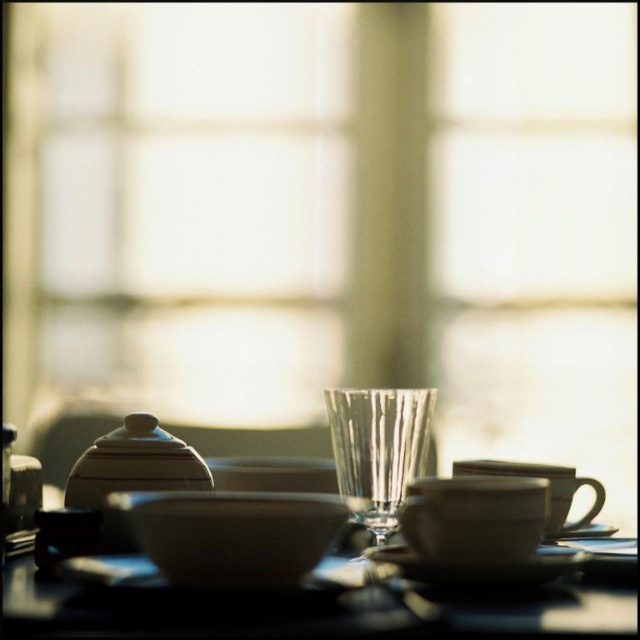
Question: Which point is closer to the camera?

Choices:
 (A) (541, 563)
 (B) (364, 522)
 (C) (499, 593)
 (D) (92, 452)

Answer: (A)

Question: Which point is closer to the camera?

Choices:
 (A) white matte saucer at lower right
 (B) black glossy saucer at center

Answer: (B)

Question: Does white glossy bowl at center come behind white matte saucer at lower right?

Choices:
 (A) no
 (B) yes

Answer: (A)

Question: Is white glossy bowl at center bigger than white matte saucer at lower right?

Choices:
 (A) yes
 (B) no

Answer: (A)

Question: Is white glossy bowl at center bigger than black glossy saucer at center?

Choices:
 (A) yes
 (B) no

Answer: (A)

Question: Among these objects, which one is nearest to the camera?

Choices:
 (A) white matte saucer at lower right
 (B) matte white teapot at left

Answer: (B)